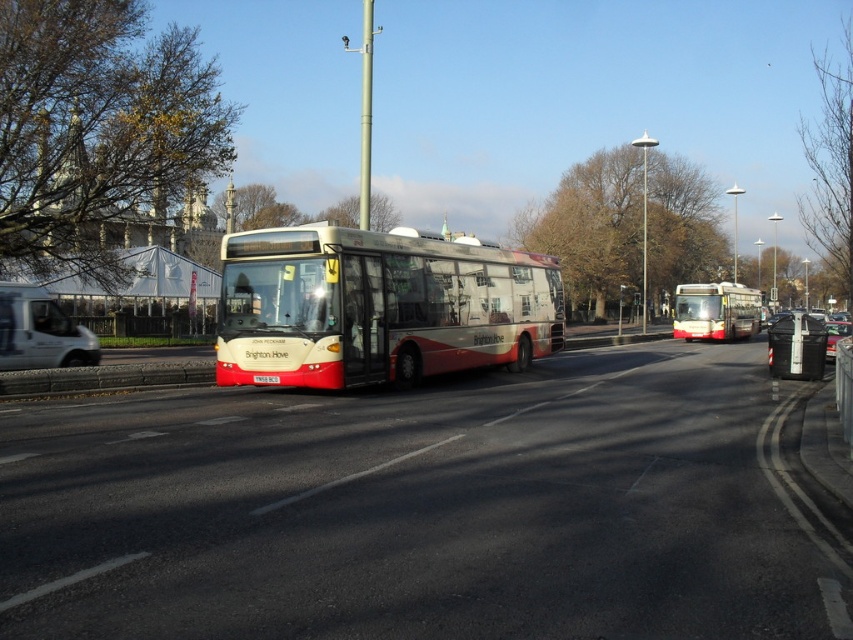
You are a pedestrian standing on the sidewalk and want to cross the road to reach a destination behind the bus. There are two points marked on the road where you could potentially cross. One is at point (680, 289) and the other at point (781, 337). Which point is closer to you as a pedestrian?

Point (680, 289) is closer to you as a pedestrian because it is further to the viewer compared to point (781, 337).

You are a pedestrian standing at the curb and see the red matte bus at center and the white plastic license plate at center. Which object is closer to you?

The red matte bus at center is closer to you because it is larger in size than the white plastic license plate at center, indicating it is nearer.

You are a delivery person who needs to place a package near the black plastic trash can at lower right. The coordinates given are point (796, 346). Is this point the correct location for the trash can?

Yes, the point (796, 346) marks the black plastic trash can at lower right, so placing the package there would be correct.